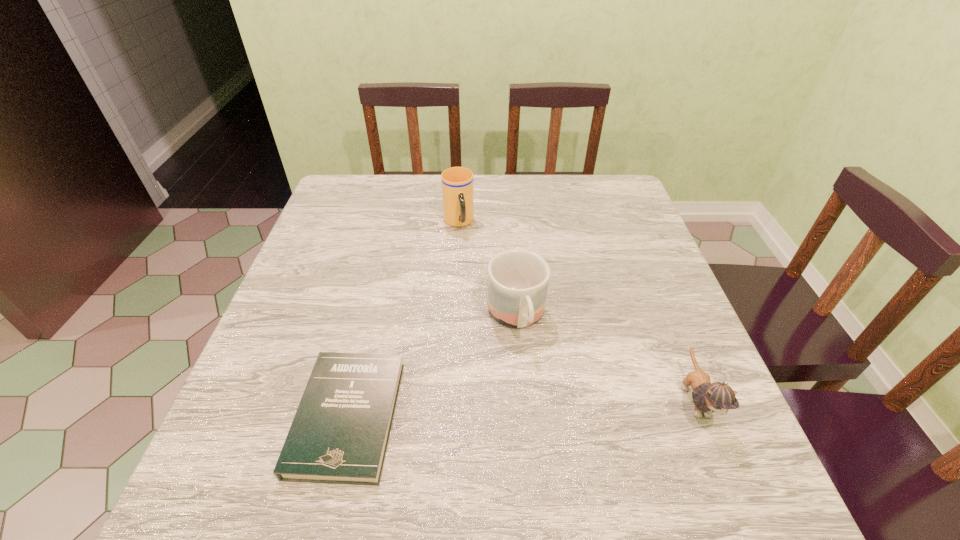
I want to click on free spot located 0.180m on the side of the farthest object with the handle, so click(477, 280).

At what (x,y) coordinates should I click in order to perform the action: click on free space located on the side with the handle of the third nearest object. Please return your answer as a coordinate pair (x, y). This screenshot has height=540, width=960. Looking at the image, I should click on (548, 423).

The height and width of the screenshot is (540, 960). What are the coordinates of `free point located 0.210m on the side with the handle of the third nearest object` in the screenshot? It's located at (555, 444).

You are a GUI agent. You are given a task and a screenshot of the screen. Output one action in this format:
    pyautogui.click(x=<x>, y=<y>)
    Task: Click on the vacant area located 0.060m on the side with the handle of the third nearest object
    
    Given the screenshot: What is the action you would take?
    coord(532,372)

At what (x,y) coordinates should I click in order to perform the action: click on object at the far edge. Please return your answer as a coordinate pair (x, y). Looking at the image, I should click on (457, 182).

At what (x,y) coordinates should I click in order to perform the action: click on book that is positioned at the near edge. Please return your answer as a coordinate pair (x, y). The width and height of the screenshot is (960, 540). Looking at the image, I should click on (339, 435).

This screenshot has width=960, height=540. What are the coordinates of `kitten that is at the near edge` in the screenshot? It's located at (718, 397).

Locate an element on the screen. object located in the left edge section of the desktop is located at coordinates tap(339, 435).

The image size is (960, 540). What are the coordinates of `object positioned at the right edge` in the screenshot? It's located at (718, 397).

You are a GUI agent. You are given a task and a screenshot of the screen. Output one action in this format:
    pyautogui.click(x=<x>, y=<y>)
    Task: Click on the object at the near left corner
    This screenshot has width=960, height=540.
    Given the screenshot: What is the action you would take?
    pyautogui.click(x=339, y=435)